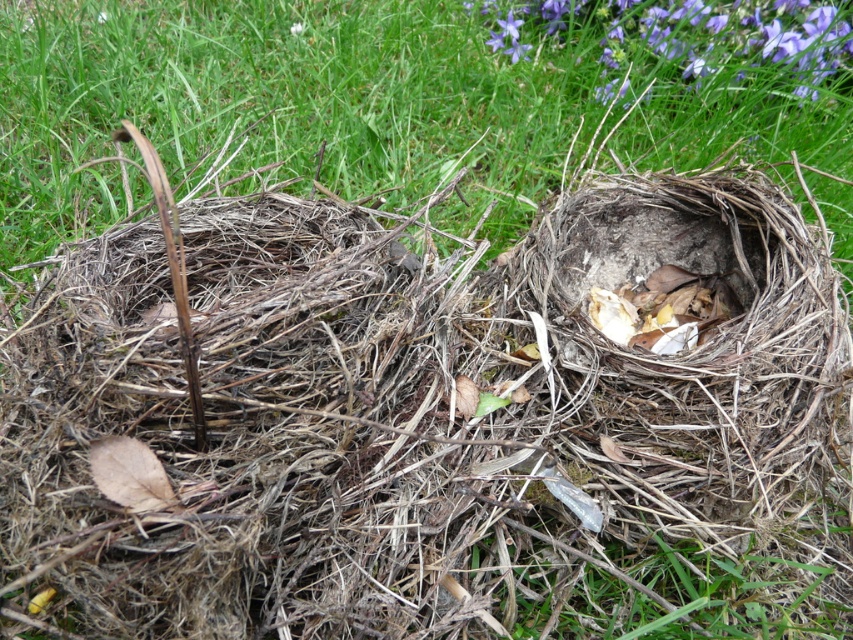
In the scene shown: Can you confirm if green dry grass at center is bigger than purple matte flower at upper right?

Answer: Yes.

How much distance is there between green dry grass at center and purple matte flower at upper right?

green dry grass at center is 19.11 inches away from purple matte flower at upper right.

Which is behind, point (236, 163) or point (695, 0)?

The point (695, 0) is more distant.

Locate an element on the screen. The width and height of the screenshot is (853, 640). green dry grass at center is located at coordinates (280, 108).